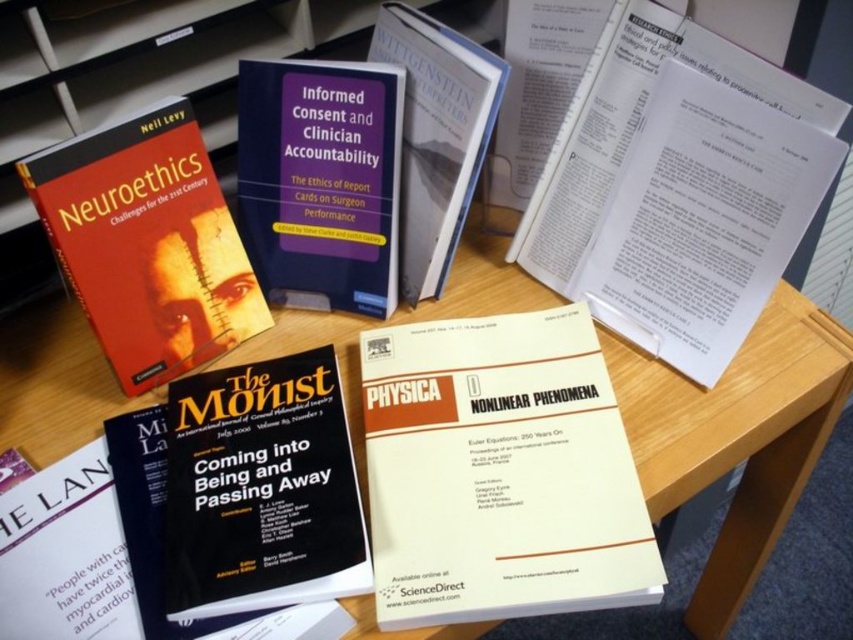
Who is shorter, matte hardcover book at upper left or matte hardcover book at center?

matte hardcover book at center

Can you confirm if matte hardcover book at upper left is taller than matte hardcover book at center?

Yes.

Is point (149, 385) farther from viewer compared to point (316, 154)?

Yes, point (149, 385) is farther from viewer.

Identify the location of matte hardcover book at upper left. (148, 243).

At what (x,y) coordinates should I click in order to perform the action: click on matte hardcover book at center. Please return your answer as a coordinate pair (x, y). Looking at the image, I should click on (320, 180).

Who is higher up, matte hardcover book at center or hardcover book at center?

hardcover book at center is higher up.

Which is behind, point (320, 160) or point (457, 76)?

Point (320, 160)

Identify the location of matte hardcover book at center. (320, 180).

Is white paper at center shorter than hardcover book at center?

Correct, white paper at center is not as tall as hardcover book at center.

Find the location of `white paper at center`. white paper at center is located at coordinates click(x=498, y=472).

Identify the location of white paper at center. The height and width of the screenshot is (640, 853). (498, 472).